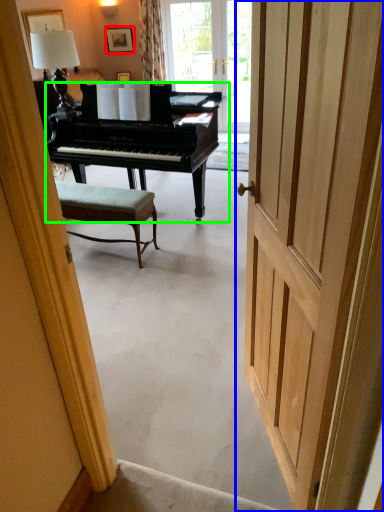
Question: Estimate the real-world distances between objects in this image. Which object is closer to picture frame (highlighted by a red box), door (highlighted by a blue box) or piano (highlighted by a green box)?

Choices:
 (A) door
 (B) piano

Answer: (B)